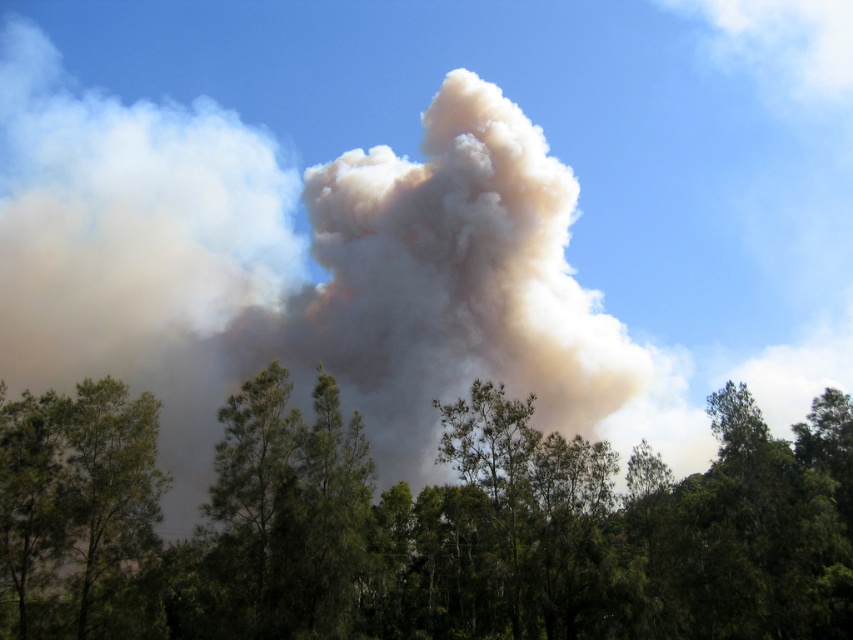
You are standing in front of the scene with the large plume of smoke and the line of trees. You notice two points marked in the image at coordinates point (241, 616) and point (149, 541). Which of these points is closer to you?

Point (241, 616) is closer to the viewer than point (149, 541).

You are a drone operator trying to navigate through the scene. The drone has a camera that can only focus on objects within a 0.5 unit radius. If the drone is positioned at the origin point, can it capture the green leafy trees at lower center in its camera view?

The green leafy trees at lower center are located at point (419, 525). The distance from the origin to this point is sqrt0.823 squared plus 0.492 squared equals approximately 0.95 units. Since the camera can only focus within 0.5 units, the drone cannot capture the green leafy trees at lower center in its camera view.